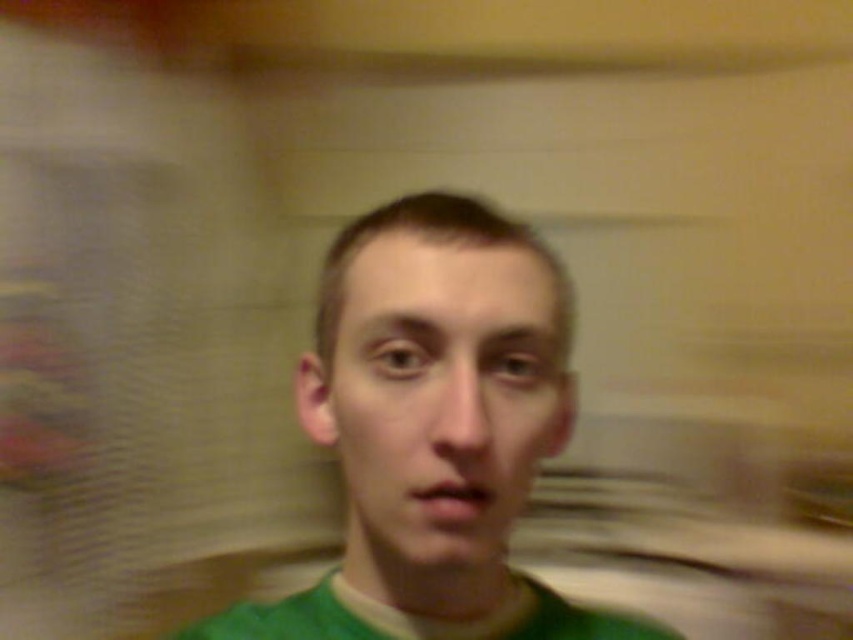
This screenshot has width=853, height=640. Describe the element at coordinates (434, 429) in the screenshot. I see `green matte shirt at center` at that location.

Is green matte shirt at center shorter than green matte face at center?

In fact, green matte shirt at center may be taller than green matte face at center.

The image size is (853, 640). What do you see at coordinates (434, 429) in the screenshot? I see `green matte shirt at center` at bounding box center [434, 429].

This screenshot has width=853, height=640. What are the coordinates of `green matte shirt at center` in the screenshot? It's located at (434, 429).